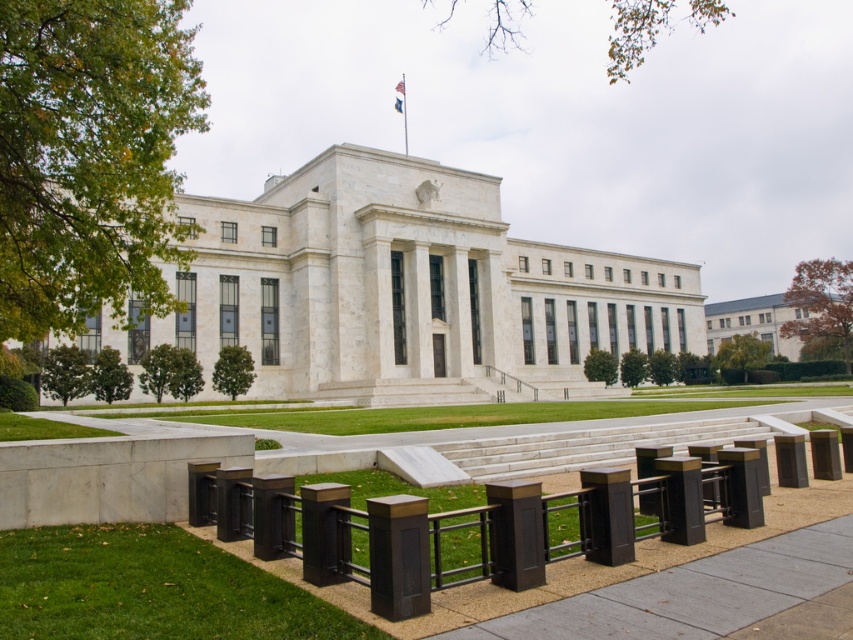
Does green grass at lower left have a lesser width compared to matte black post at center?

No.

Which is in front, point (3, 612) or point (525, 528)?

Point (3, 612) is in front.

Where is `green grass at lower left`? green grass at lower left is located at coordinates (149, 588).

Can you confirm if matte brown post at center is smaller than matte black post at center?

Yes, matte brown post at center is smaller than matte black post at center.

Can you confirm if matte brown post at center is positioned below matte black post at center?

Actually, matte brown post at center is above matte black post at center.

The image size is (853, 640). I want to click on matte brown post at center, so click(398, 556).

Does point (212, 580) lie behind point (422, 568)?

Yes, it is behind point (422, 568).

Is green grass at lower left to the right of matte brown post at center from the viewer's perspective?

In fact, green grass at lower left is to the left of matte brown post at center.

Does point (273, 625) come behind point (405, 596)?

No, it is not.

What are the coordinates of `green grass at lower left` in the screenshot? It's located at (149, 588).